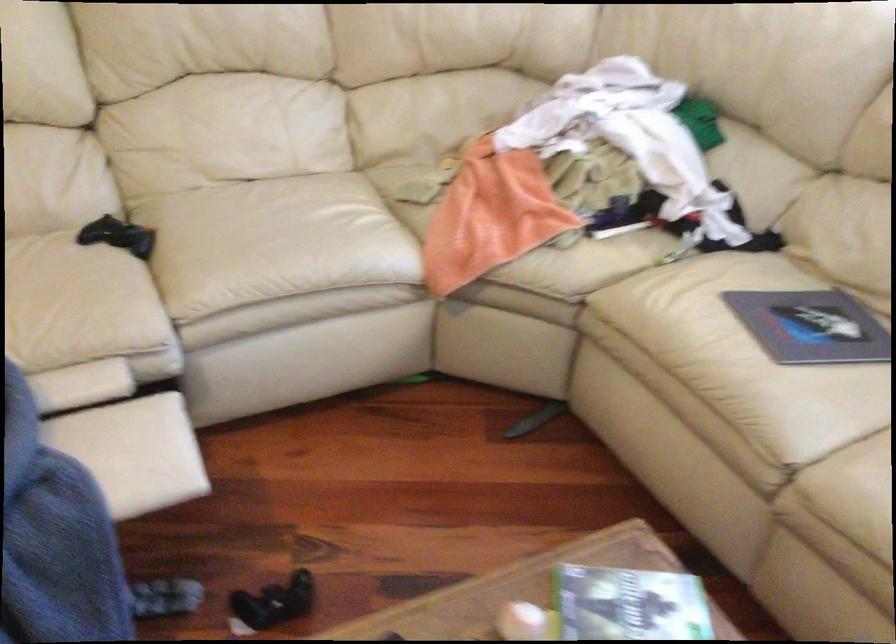
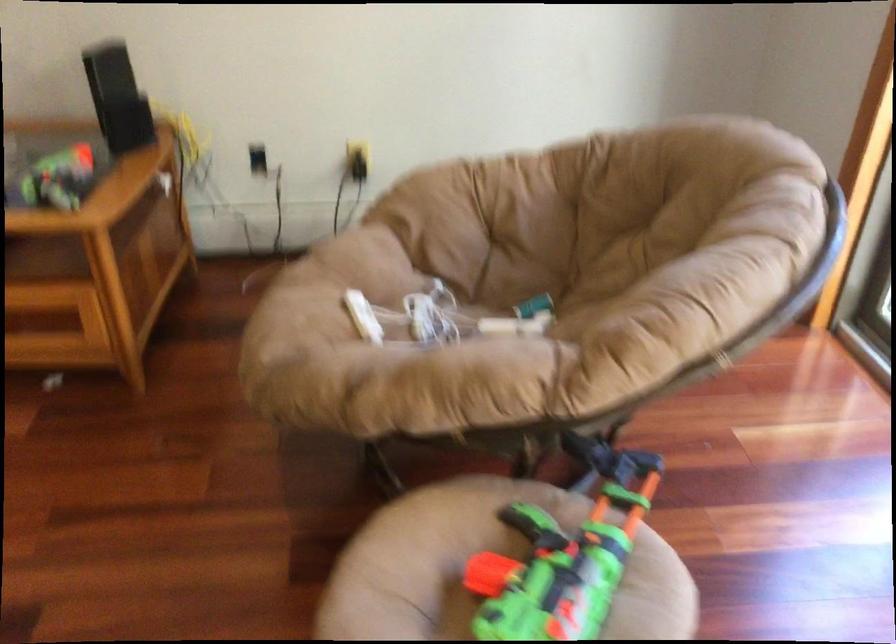
The images are taken continuously from a first-person perspective. In which direction are you moving?

The movement direction of the cameraman is right, forward.